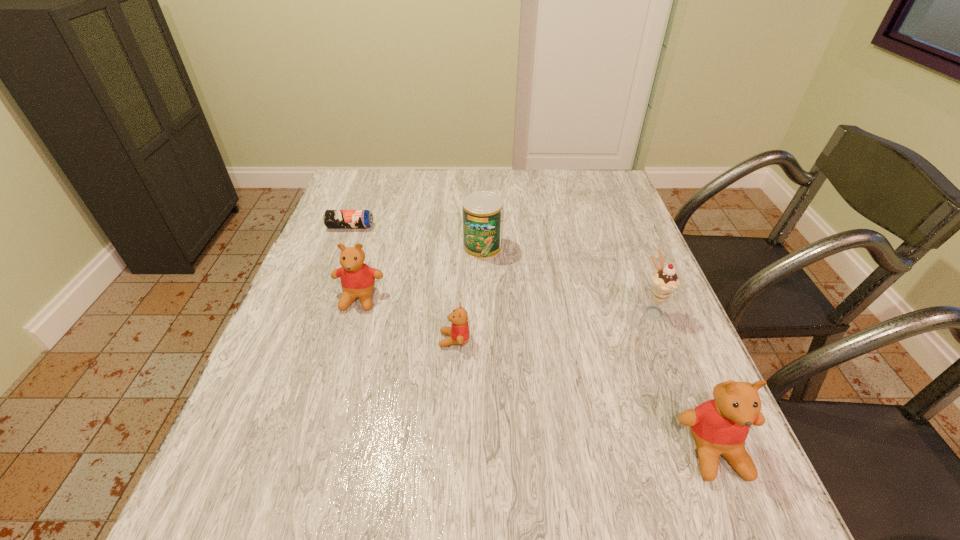
The height and width of the screenshot is (540, 960). Identify the location of free space between the second farthest teddy bear and the second farthest object. (468, 293).

Image resolution: width=960 pixels, height=540 pixels. What are the coordinates of `vacant space in between the icecream and the fifth tallest object` in the screenshot? It's located at (554, 325).

You are a GUI agent. You are given a task and a screenshot of the screen. Output one action in this format:
    pyautogui.click(x=<x>, y=<y>)
    Task: Click on the vacant space that is in between the icecream and the beer can
    
    Given the screenshot: What is the action you would take?
    (501, 268)

Where is `empty location between the icecream and the rightmost teddy bear`? The height and width of the screenshot is (540, 960). empty location between the icecream and the rightmost teddy bear is located at coordinates (684, 381).

The width and height of the screenshot is (960, 540). Identify the location of empty space between the second shortest teddy bear and the nearest teddy bear. (537, 375).

Identify the location of free space between the second tallest teddy bear and the icecream. (506, 305).

Locate an element on the screen. free space between the nearest teddy bear and the beer can is located at coordinates (533, 339).

You are a GUI agent. You are given a task and a screenshot of the screen. Output one action in this format:
    pyautogui.click(x=<x>, y=<y>)
    Task: Click on the object that stands as the third closest to the beer can
    This screenshot has width=960, height=540.
    Given the screenshot: What is the action you would take?
    459,331

Locate which object ranks fifth in proximity to the farthest teddy bear. Please provide its 2D coordinates. Your answer should be formatted as a tuple, i.e. [(x, y)], where the tuple contains the x and y coordinates of a point satisfying the conditions above.

[(720, 426)]

Identify the location of the closest teddy bear to the second farthest object. (357, 279).